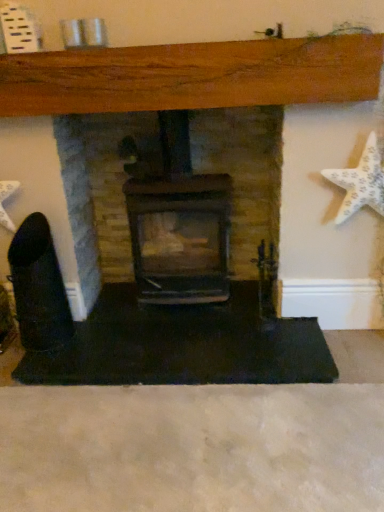
Question: Choose the correct answer: Is white textured starfish at right inside black matte fireplace at center, marked as the 1th fireplace in a left-to-right arrangement, or outside it?

Choices:
 (A) inside
 (B) outside

Answer: (B)

Question: Relative to black matte fireplace at center, marked as the 1th fireplace in a left-to-right arrangement, is white textured starfish at right in front or behind?

Choices:
 (A) behind
 (B) front

Answer: (B)

Question: Which object is positioned farthest from the black matte fireplace at center, marked as the 1th fireplace in a left-to-right arrangement?

Choices:
 (A) white textured starfish at right
 (B) matte black fireplace at center, which is the 1th fireplace from right to left

Answer: (A)

Question: Which of these objects is positioned closest to the white textured starfish at right?

Choices:
 (A) black matte fireplace at center, the second fireplace viewed from the right
 (B) matte black fireplace at center, which is the second fireplace in left-to-right order

Answer: (B)